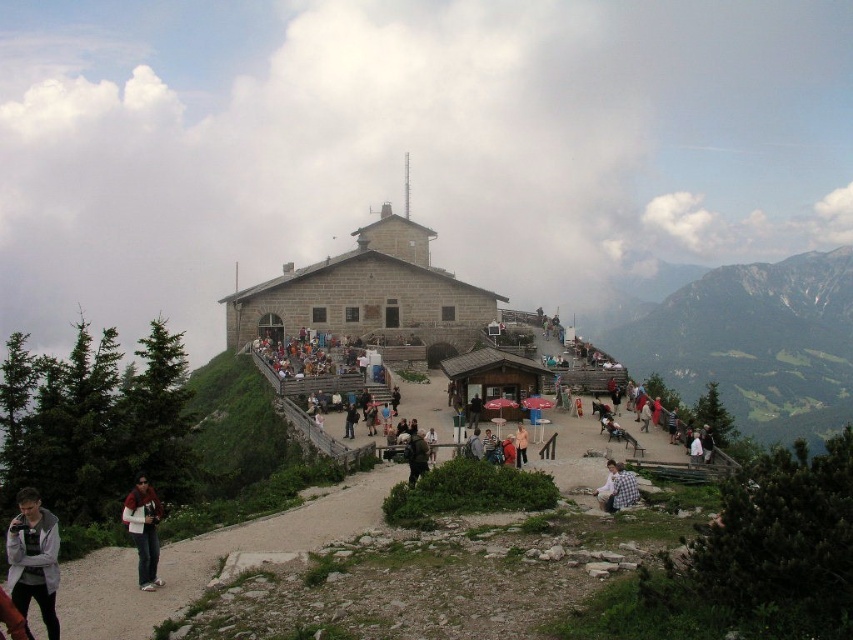
Does matte black jacket at lower left appear on the right side of checkered fabric shirt at lower right?

No, matte black jacket at lower left is not to the right of checkered fabric shirt at lower right.

Does matte black jacket at lower left have a lesser height compared to checkered fabric shirt at lower right?

Incorrect, matte black jacket at lower left's height does not fall short of checkered fabric shirt at lower right's.

I want to click on matte black jacket at lower left, so click(x=143, y=531).

Is point (229, 300) positioned after point (148, 547)?

Yes.

Does gray stone building at center have a greater height compared to matte black jacket at lower left?

Correct, gray stone building at center is much taller as matte black jacket at lower left.

Does point (428, 307) come behind point (126, 525)?

Yes, point (428, 307) is farther from viewer.

The width and height of the screenshot is (853, 640). I want to click on gray stone building at center, so click(367, 296).

Does gray stone building at center appear over gray fleece jacket at lower left?

Yes, gray stone building at center is above gray fleece jacket at lower left.

Describe the element at coordinates (367, 296) in the screenshot. This screenshot has height=640, width=853. I see `gray stone building at center` at that location.

The image size is (853, 640). What do you see at coordinates (367, 296) in the screenshot?
I see `gray stone building at center` at bounding box center [367, 296].

In order to click on gray stone building at center in this screenshot , I will do `click(367, 296)`.